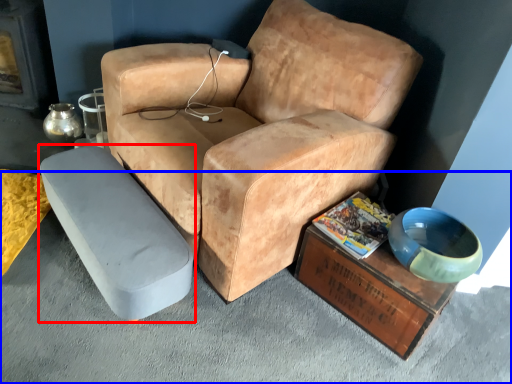
Question: Which object is closer to the camera taking this photo, table (highlighted by a red box) or concrete (highlighted by a blue box)?

Choices:
 (A) table
 (B) concrete

Answer: (B)